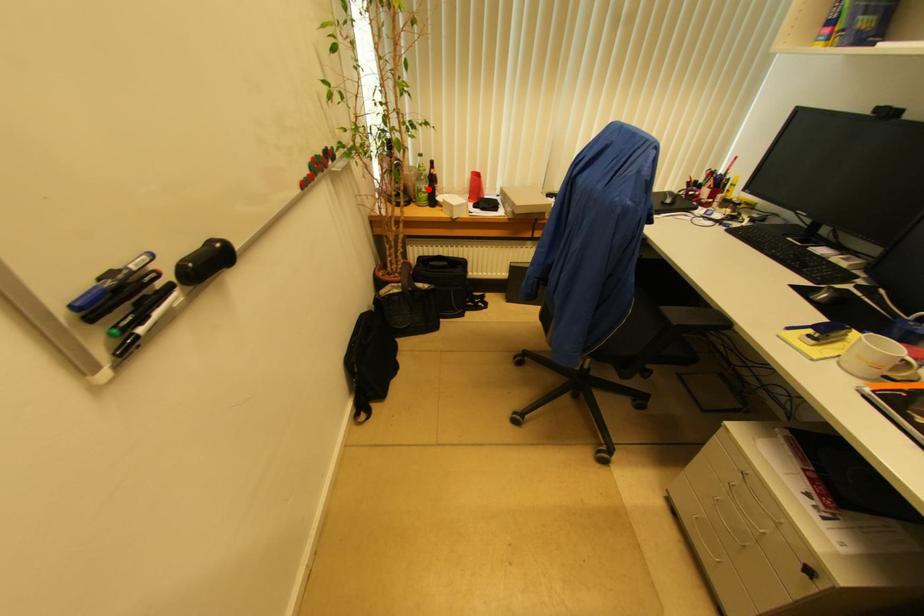
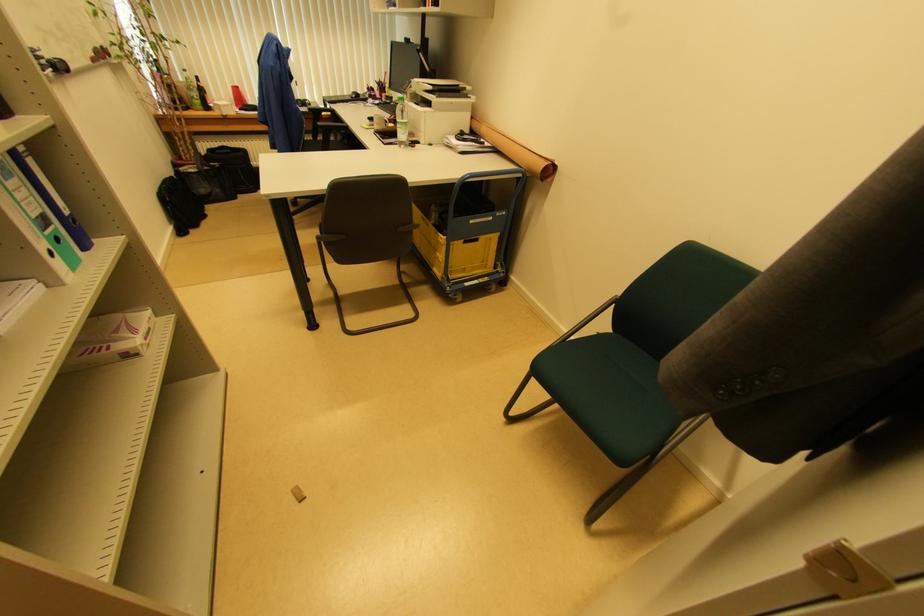
Question: I am providing you with two images of the same scene from different viewpoints. Image1 has a red point marked. In image2, the corresponding 3D location appears at what relative position? Reply with the corresponding letter.

Choices:
 (A) Closer
 (B) Farther

Answer: (B)